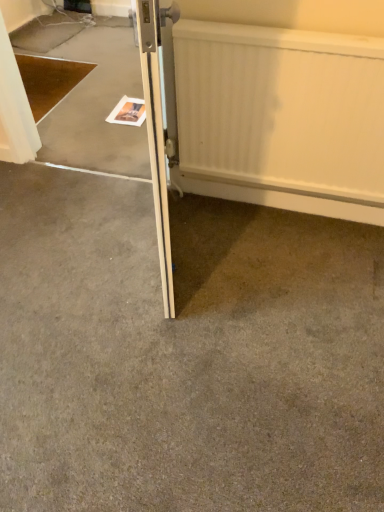
Question: From a real-world perspective, is gray carpet at center above or below wooden door at center?

Choices:
 (A) below
 (B) above

Answer: (A)

Question: In the image, is gray carpet at center positioned in front of or behind wooden door at center?

Choices:
 (A) front
 (B) behind

Answer: (B)

Question: Which object is positioned closest to the gray carpet at center?

Choices:
 (A) white textured radiator at upper right
 (B) wooden door at center

Answer: (B)

Question: Which of these objects is positioned closest to the gray carpet at center?

Choices:
 (A) wooden door at center
 (B) white textured radiator at upper right

Answer: (A)